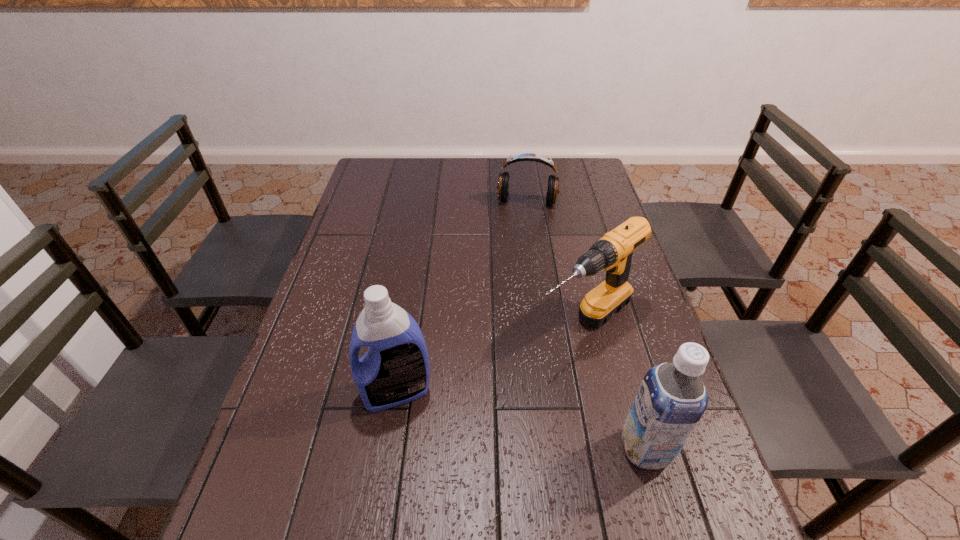
Where is `vacant area that lies between the drill and the second nearest object`? This screenshot has height=540, width=960. vacant area that lies between the drill and the second nearest object is located at coordinates (491, 358).

Locate an element on the screen. This screenshot has height=540, width=960. free area in between the headset and the soya milk is located at coordinates (586, 325).

Identify the location of free space between the farthest object and the third nearest object. The image size is (960, 540). [x=556, y=264].

Point out which object is positioned as the nearest to the leftmost object. Please provide its 2D coordinates. Your answer should be formatted as a tuple, i.e. [(x, y)], where the tuple contains the x and y coordinates of a point satisfying the conditions above.

[(613, 252)]

Identify the location of the second closest object to the farthest object. The height and width of the screenshot is (540, 960). (395, 370).

Locate an element on the screen. vacant space that satisfies the following two spatial constraints: 1. on the front side of the shortest object; 2. on the label of the soya milk is located at coordinates (561, 449).

At what (x,y) coordinates should I click in order to perform the action: click on free region that satisfies the following two spatial constraints: 1. on the back side of the drill; 2. on the right side of the second nearest object. Please return your answer as a coordinate pair (x, y). This screenshot has width=960, height=540. Looking at the image, I should click on (407, 325).

Identify the location of free region that satisfies the following two spatial constraints: 1. on the back side of the leftmost object; 2. on the right side of the farthest object. (427, 202).